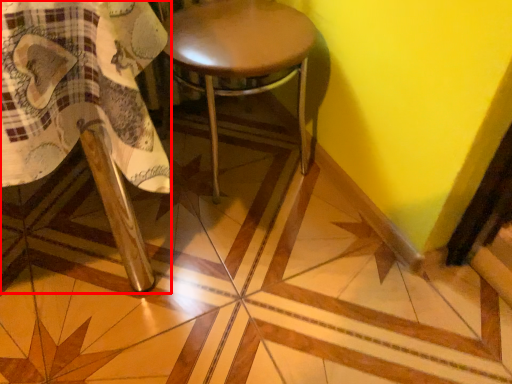
Question: Observing the image, what is the correct spatial positioning of chair (annotated by the red box) in reference to stool?

Choices:
 (A) right
 (B) left

Answer: (B)